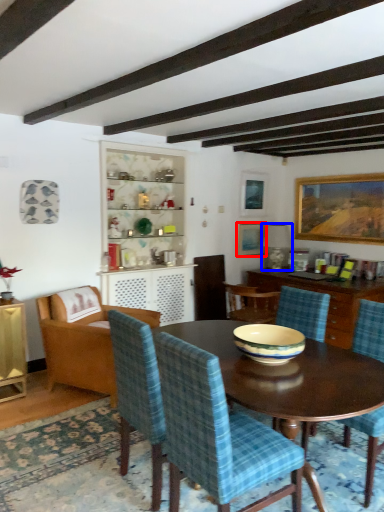
Question: Which point is closer to the camera, picture frame (highlighted by a red box) or lamp (highlighted by a blue box)?

Choices:
 (A) picture frame
 (B) lamp

Answer: (B)